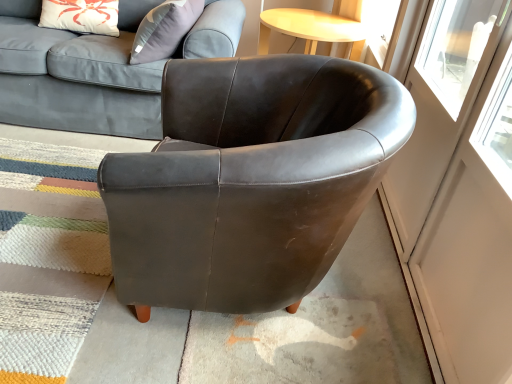
Question: Looking at their shapes, would you say transparent glass screen door at right is wider or thinner than matte brown leather armchair at center?

Choices:
 (A) thin
 (B) wide

Answer: (A)

Question: Is transparent glass screen door at right in front of or behind matte brown leather armchair at center in the image?

Choices:
 (A) behind
 (B) front

Answer: (B)

Question: Considering the real-world distances, which object is closest to the transparent glass screen door at right?

Choices:
 (A) matte brown leather armchair at center
 (B) matte gray fabric couch at upper left

Answer: (A)

Question: Considering the real-world distances, which object is closest to the matte brown leather armchair at center?

Choices:
 (A) matte gray fabric couch at upper left
 (B) transparent glass screen door at right

Answer: (B)